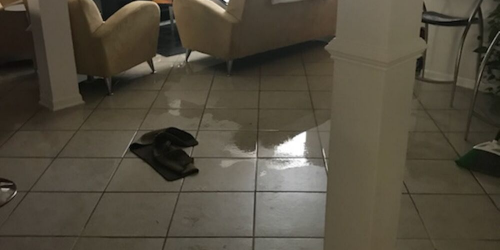
This screenshot has width=500, height=250. I want to click on broom briscles, so click(x=483, y=160).